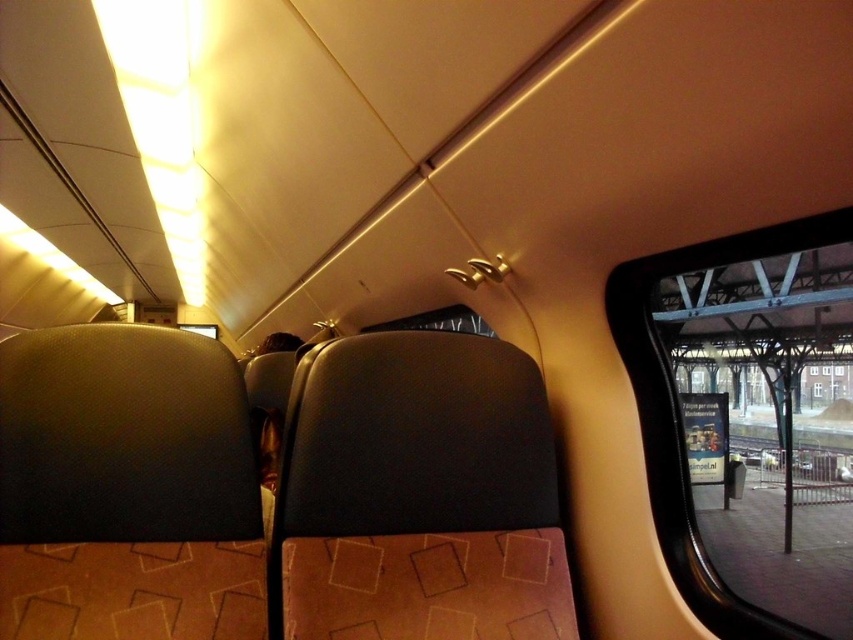
Question: Observing the image, what is the correct spatial positioning of clear glass window at upper right in reference to transparent glass window at center?

Choices:
 (A) below
 (B) above

Answer: (B)

Question: Does clear glass window at upper right have a greater width compared to transparent glass window at center?

Choices:
 (A) yes
 (B) no

Answer: (B)

Question: Which point appears closest to the camera in this image?

Choices:
 (A) (672, 432)
 (B) (811, 392)

Answer: (A)

Question: Can you confirm if clear glass window at upper right is smaller than transparent glass window at center?

Choices:
 (A) no
 (B) yes

Answer: (A)